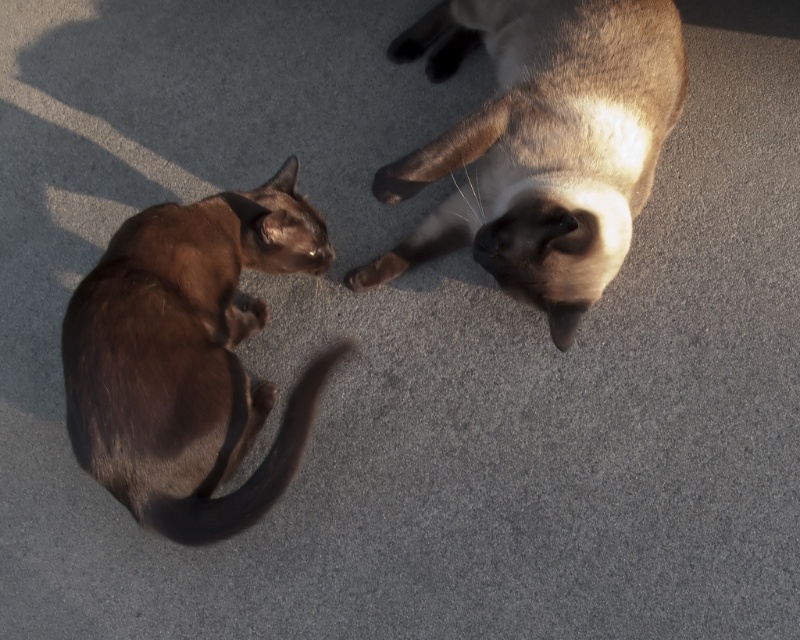
Question: Where is satin brown cat at upper right located in relation to brown fur cat at left in the image?

Choices:
 (A) right
 (B) left

Answer: (A)

Question: Among these objects, which one is farthest from the camera?

Choices:
 (A) brown fur cat at left
 (B) satin brown cat at upper right

Answer: (B)

Question: Which object appears farthest from the camera in this image?

Choices:
 (A) satin brown cat at upper right
 (B) brown fur cat at left

Answer: (A)

Question: Does satin brown cat at upper right have a lesser width compared to brown fur cat at left?

Choices:
 (A) no
 (B) yes

Answer: (A)

Question: Is satin brown cat at upper right smaller than brown fur cat at left?

Choices:
 (A) no
 (B) yes

Answer: (A)

Question: Which point is closer to the camera?

Choices:
 (A) satin brown cat at upper right
 (B) brown fur cat at left

Answer: (B)